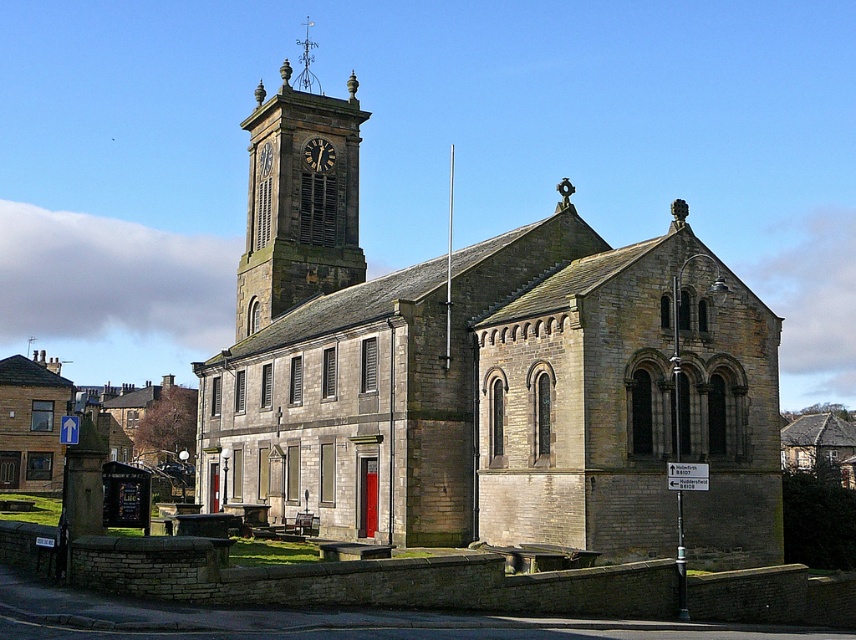
You are standing in front of the historic stone church and want to take a photo of the clock tower. Since the clock is part of the tower, which object should you focus on to capture both the stone church at center and the matte stone clock at upper center in your shot?

You should focus on the stone church at center because it is located below the matte stone clock at upper center, ensuring both are in the frame.

You are an architect examining the church from the ground. You notice the polished metal spire at upper center and the matte stone clock at upper center. Which of these two objects is positioned higher in the vertical direction?

The polished metal spire at upper center is taller than the matte stone clock at upper center, so it is positioned higher in the vertical direction.